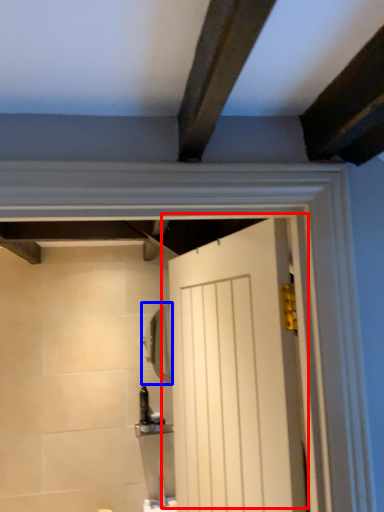
Question: Which object appears closest to the camera in this image, door (highlighted by a red box) or mirror (highlighted by a blue box)?

Choices:
 (A) door
 (B) mirror

Answer: (A)